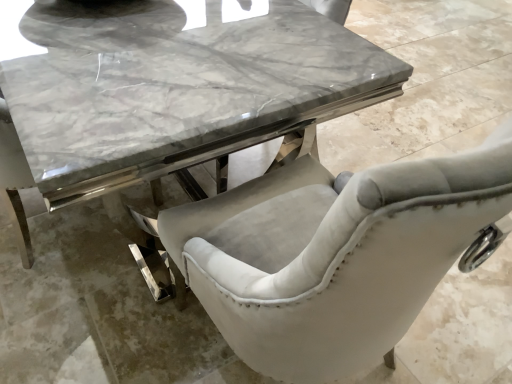
Identify the location of marble table at center. (185, 114).

Describe the element at coordinates (185, 114) in the screenshot. I see `marble table at center` at that location.

You are a GUI agent. You are given a task and a screenshot of the screen. Output one action in this format:
    pyautogui.click(x=<x>, y=<y>)
    Task: Click on the marble table at center
    This screenshot has height=384, width=512.
    Given the screenshot: What is the action you would take?
    pyautogui.click(x=185, y=114)